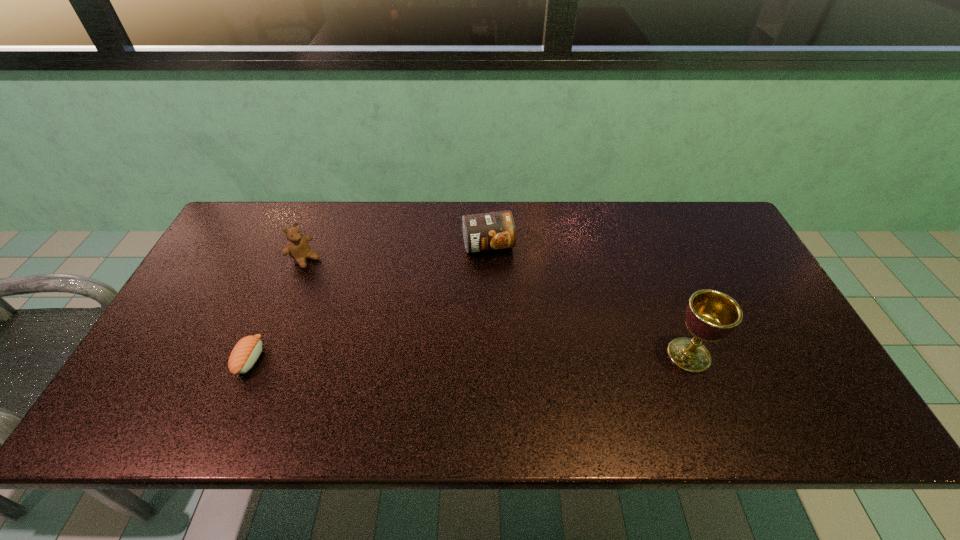
At what (x,y) coordinates should I click in order to perform the action: click on vacant space on the desktop that is between the shortest object and the rightmost object and is positioned on the face of the teddy bear. Please return your answer as a coordinate pair (x, y). The height and width of the screenshot is (540, 960). Looking at the image, I should click on (437, 357).

The image size is (960, 540). What are the coordinates of `free space on the desktop that is between the shortest object and the chalice and is positioned on the front label of the can` in the screenshot? It's located at (521, 356).